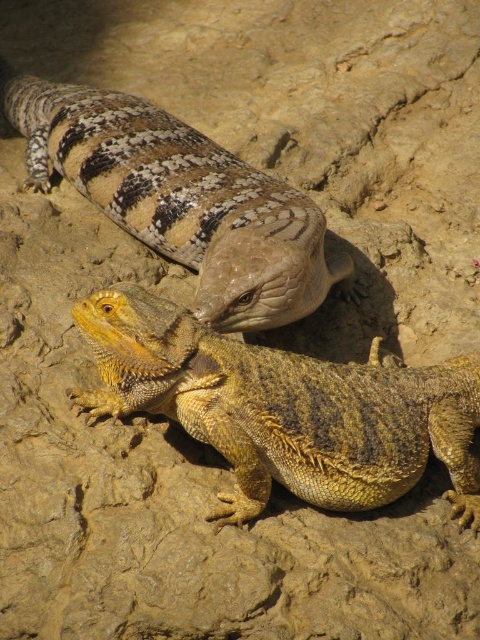
Can you confirm if yellow scaly lizard at lower left is positioned to the right of speckled sandstone lizard at upper center?

Indeed, yellow scaly lizard at lower left is positioned on the right side of speckled sandstone lizard at upper center.

Is yellow scaly lizard at lower left taller than speckled sandstone lizard at upper center?

No.

Locate an element on the screen. The height and width of the screenshot is (640, 480). yellow scaly lizard at lower left is located at coordinates (285, 408).

In order to click on yellow scaly lizard at lower left in this screenshot , I will do `click(285, 408)`.